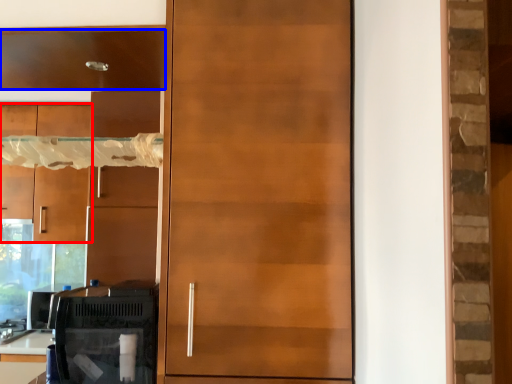
Question: Which of the following is the closest to the observer, cabinetry (highlighted by a red box) or cabinetry (highlighted by a blue box)?

Choices:
 (A) cabinetry
 (B) cabinetry

Answer: (B)